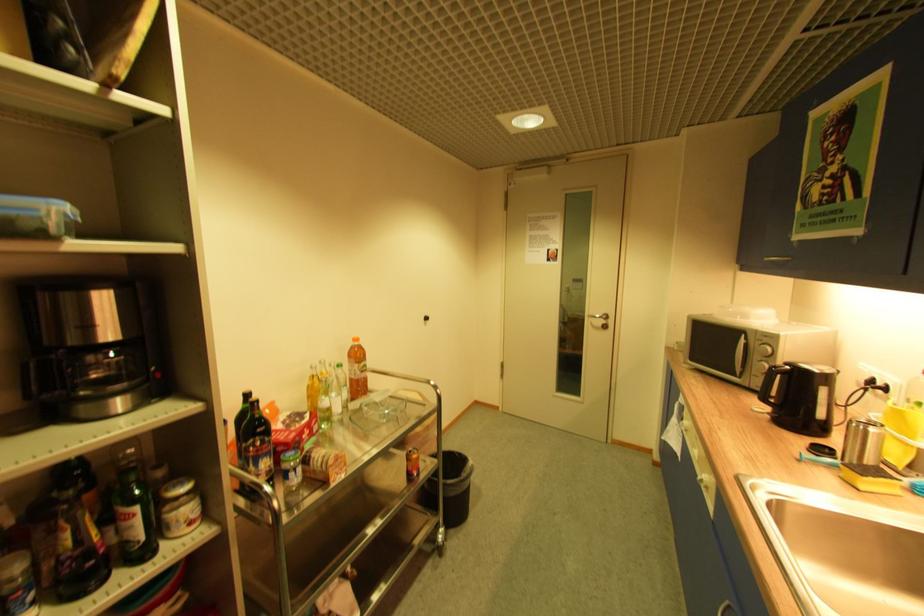
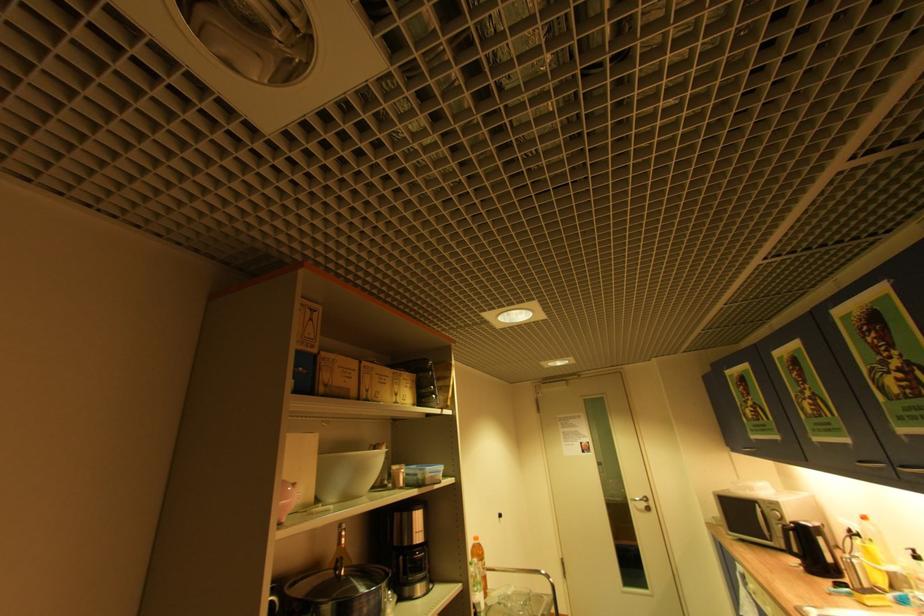
Where in the second image is the point corresponding to point 609,323 from the first image?

(650, 505)